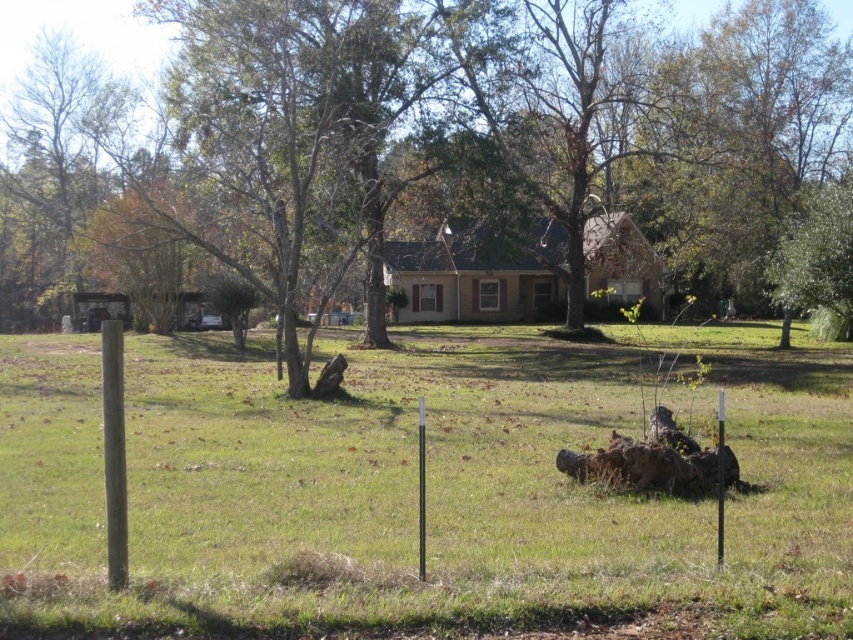
Which is in front, point (726, 563) or point (53, 4)?

Point (726, 563) is more forward.

Does point (77, 380) lie in front of point (21, 24)?

Yes, it is.

You are a GUI agent. You are given a task and a screenshot of the screen. Output one action in this format:
    pyautogui.click(x=<x>, y=<y>)
    Task: Click on the green grass at center
    
    Given the screenshot: What is the action you would take?
    pyautogui.click(x=413, y=490)